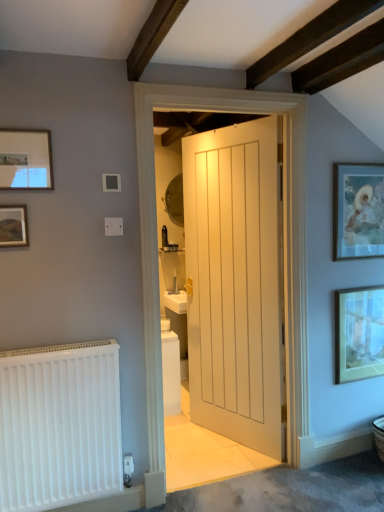
Question: Considering the relative positions of matte black picture frame at upper left, the 3th picture frame from the right, and white matte radiator at lower left in the image provided, is matte black picture frame at upper left, the 3th picture frame from the right, to the left of white matte radiator at lower left from the viewer's perspective?

Choices:
 (A) yes
 (B) no

Answer: (A)

Question: From the image's perspective, is matte black picture frame at upper left, the 2th picture frame viewed from the front, below white matte radiator at lower left?

Choices:
 (A) yes
 (B) no

Answer: (B)

Question: Is matte black picture frame at upper left, the 3th picture frame from the right, beside white matte radiator at lower left?

Choices:
 (A) no
 (B) yes

Answer: (A)

Question: Considering the relative positions of matte black picture frame at upper left, the second picture frame positioned from the left, and white matte radiator at lower left in the image provided, is matte black picture frame at upper left, the second picture frame positioned from the left, to the right of white matte radiator at lower left from the viewer's perspective?

Choices:
 (A) yes
 (B) no

Answer: (B)

Question: Is matte black picture frame at upper left, the 3th picture frame from the right, turned away from white matte radiator at lower left?

Choices:
 (A) yes
 (B) no

Answer: (B)

Question: From the image's perspective, is matte gold picture frame at right, arranged as the 1th picture frame when viewed from the back, located above or below matte black picture frame at upper left, the 2th picture frame viewed from the front?

Choices:
 (A) above
 (B) below

Answer: (B)

Question: Is matte gold picture frame at right, which is the 1th picture frame in right-to-left order, wider or thinner than matte black picture frame at upper left, the third picture frame viewed from the back?

Choices:
 (A) wide
 (B) thin

Answer: (A)

Question: Is matte gold picture frame at right, which is the 1th picture frame in right-to-left order, bigger or smaller than matte black picture frame at upper left, the second picture frame positioned from the left?

Choices:
 (A) big
 (B) small

Answer: (A)

Question: Relative to matte black picture frame at upper left, the second picture frame positioned from the left, is matte gold picture frame at right, the fourth picture frame positioned from the front, in front or behind?

Choices:
 (A) behind
 (B) front

Answer: (A)

Question: Would you say white matte radiator at lower left is inside or outside matte gold picture frame at right, which is the 1th picture frame in right-to-left order?

Choices:
 (A) outside
 (B) inside

Answer: (A)

Question: Is white matte radiator at lower left bigger or smaller than matte gold picture frame at right, which appears as the 4th picture frame when viewed from the left?

Choices:
 (A) big
 (B) small

Answer: (A)

Question: Is white matte radiator at lower left in front of or behind matte gold picture frame at right, the fourth picture frame positioned from the front, in the image?

Choices:
 (A) behind
 (B) front

Answer: (B)

Question: Is white matte radiator at lower left wider or thinner than matte gold picture frame at right, the fourth picture frame positioned from the front?

Choices:
 (A) thin
 (B) wide

Answer: (B)

Question: Visually, is matte black picture frame at upper left, the 3th picture frame from the right, positioned to the left or to the right of matte white picture frame at upper left, which is the first picture frame from front to back?

Choices:
 (A) right
 (B) left

Answer: (A)

Question: Considering the positions of matte black picture frame at upper left, the 2th picture frame viewed from the front, and matte white picture frame at upper left, which is counted as the fourth picture frame, starting from the back, in the image, is matte black picture frame at upper left, the 2th picture frame viewed from the front, wider or thinner than matte white picture frame at upper left, which is counted as the fourth picture frame, starting from the back,?

Choices:
 (A) wide
 (B) thin

Answer: (B)